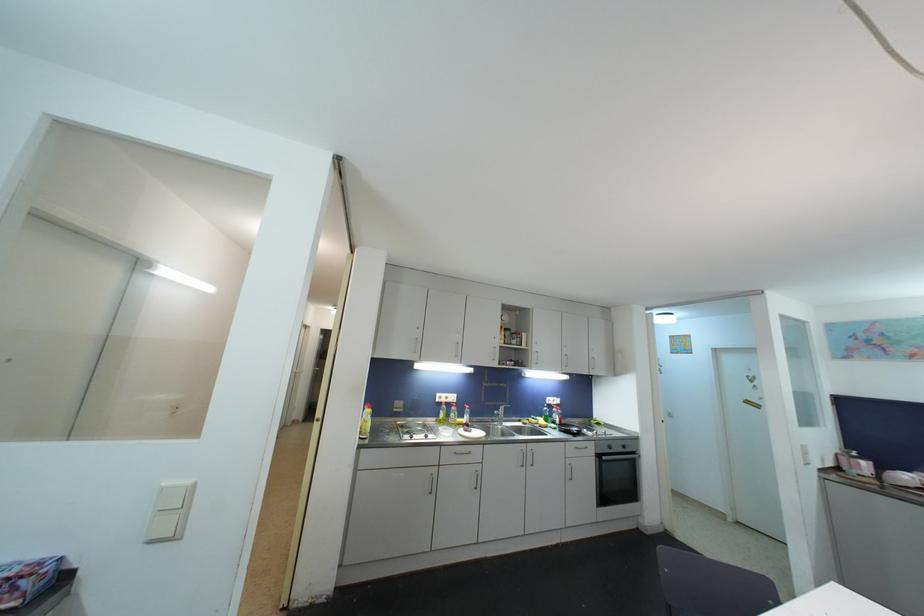
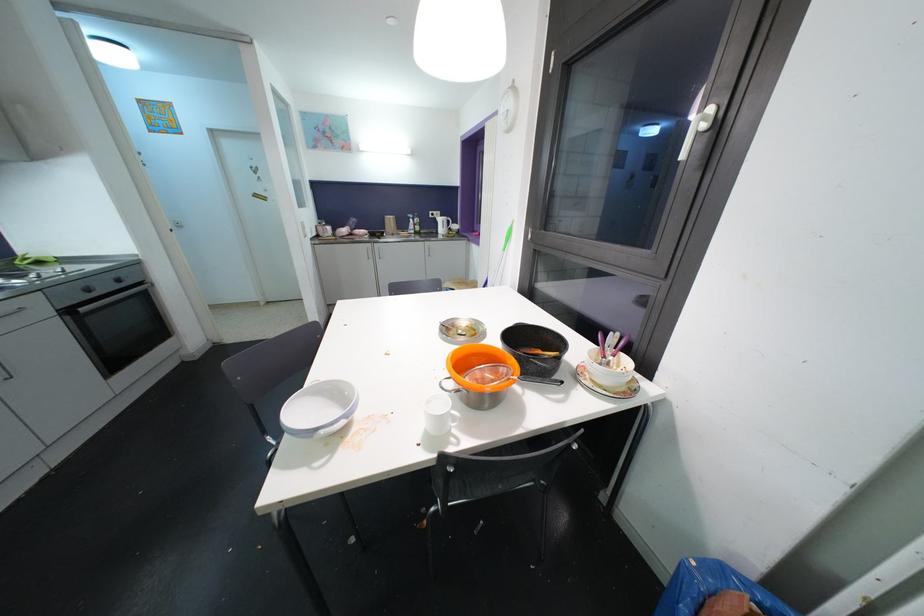
The point at (625, 445) is marked in the first image. Where is the corresponding point in the second image?

(116, 278)